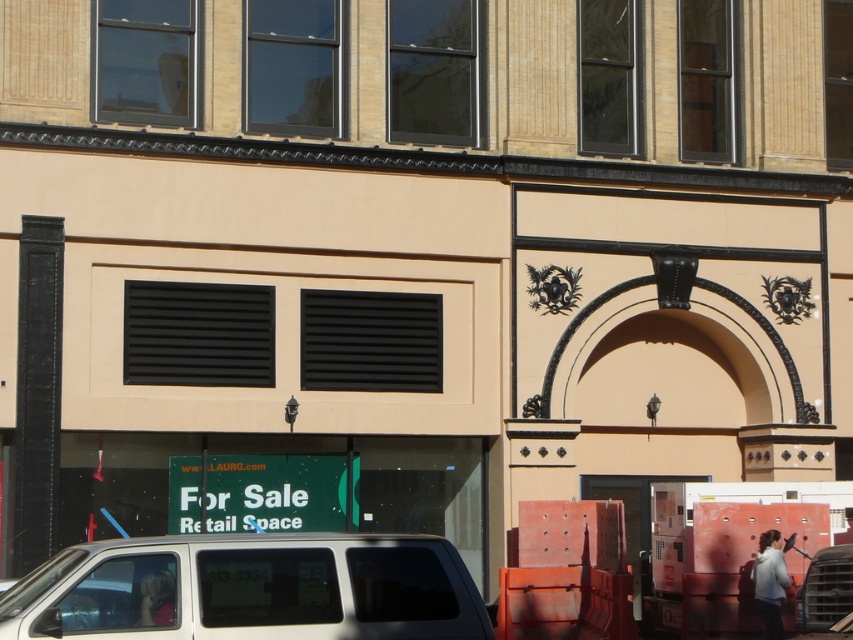
Question: Does white matte van at lower left have a lesser width compared to blonde hair at lower left?

Choices:
 (A) yes
 (B) no

Answer: (B)

Question: Which of the following is the closest to the observer?

Choices:
 (A) blonde hair at lower left
 (B) white matte van at lower left

Answer: (B)

Question: Can you confirm if white matte van at lower left is bigger than blonde hair at lower left?

Choices:
 (A) no
 (B) yes

Answer: (B)

Question: Which is farther from the white hoodie at lower right?

Choices:
 (A) white matte van at lower left
 (B) blonde hair at lower left

Answer: (B)

Question: Which object is farther from the camera taking this photo?

Choices:
 (A) white hoodie at lower right
 (B) white matte van at lower left
 (C) blonde hair at lower left

Answer: (A)

Question: Can you confirm if white matte van at lower left is wider than white hoodie at lower right?

Choices:
 (A) no
 (B) yes

Answer: (B)